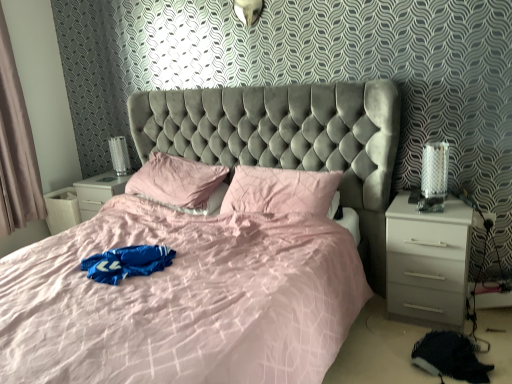
Question: Are light beige fabric curtain at left and pink fabric pillow at center far apart?

Choices:
 (A) yes
 (B) no

Answer: (A)

Question: Does light beige fabric curtain at left come in front of pink fabric pillow at center?

Choices:
 (A) no
 (B) yes

Answer: (A)

Question: Considering the relative positions of light beige fabric curtain at left and pink fabric pillow at center in the image provided, is light beige fabric curtain at left to the right of pink fabric pillow at center from the viewer's perspective?

Choices:
 (A) yes
 (B) no

Answer: (B)

Question: Is light beige fabric curtain at left turned away from pink fabric pillow at center?

Choices:
 (A) no
 (B) yes

Answer: (A)

Question: Considering the relative sizes of light beige fabric curtain at left and pink fabric pillow at center in the image provided, is light beige fabric curtain at left thinner than pink fabric pillow at center?

Choices:
 (A) no
 (B) yes

Answer: (B)

Question: From the image's perspective, relative to black fuzzy blanket at lower right, is white glossy nightstand at right above or below?

Choices:
 (A) above
 (B) below

Answer: (A)

Question: Looking at their shapes, would you say white glossy nightstand at right is wider or thinner than black fuzzy blanket at lower right?

Choices:
 (A) wide
 (B) thin

Answer: (A)

Question: Choose the correct answer: Is white glossy nightstand at right inside black fuzzy blanket at lower right or outside it?

Choices:
 (A) outside
 (B) inside

Answer: (A)

Question: In terms of size, does white glossy nightstand at right appear bigger or smaller than black fuzzy blanket at lower right?

Choices:
 (A) small
 (B) big

Answer: (B)

Question: In the image, is light beige fabric curtain at left positioned in front of or behind velvet grey bed at center?

Choices:
 (A) front
 (B) behind

Answer: (B)

Question: Considering the positions of light beige fabric curtain at left and velvet grey bed at center in the image, is light beige fabric curtain at left wider or thinner than velvet grey bed at center?

Choices:
 (A) thin
 (B) wide

Answer: (A)

Question: In terms of height, does light beige fabric curtain at left look taller or shorter compared to velvet grey bed at center?

Choices:
 (A) short
 (B) tall

Answer: (B)

Question: In terms of size, does light beige fabric curtain at left appear bigger or smaller than velvet grey bed at center?

Choices:
 (A) big
 (B) small

Answer: (B)

Question: Considering the positions of point [x=32, y=163] and point [x=442, y=367], is point [x=32, y=163] closer or farther from the camera than point [x=442, y=367]?

Choices:
 (A) closer
 (B) farther

Answer: (B)

Question: In the image, is light beige fabric curtain at left on the left side or the right side of black fuzzy blanket at lower right?

Choices:
 (A) left
 (B) right

Answer: (A)